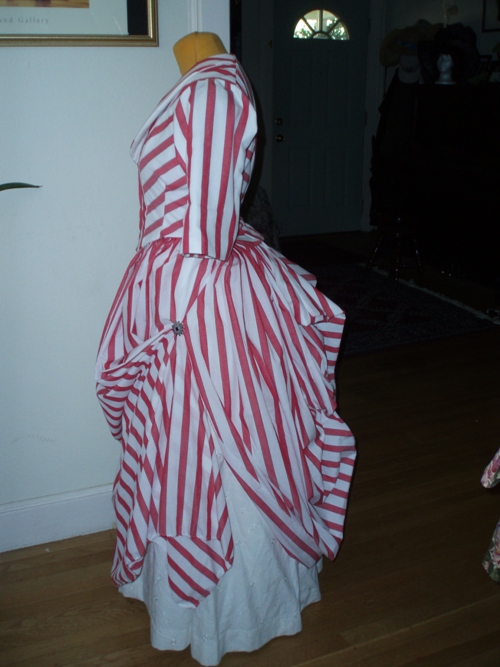
This screenshot has width=500, height=667. I want to click on photo or artwork, so click(x=97, y=19).